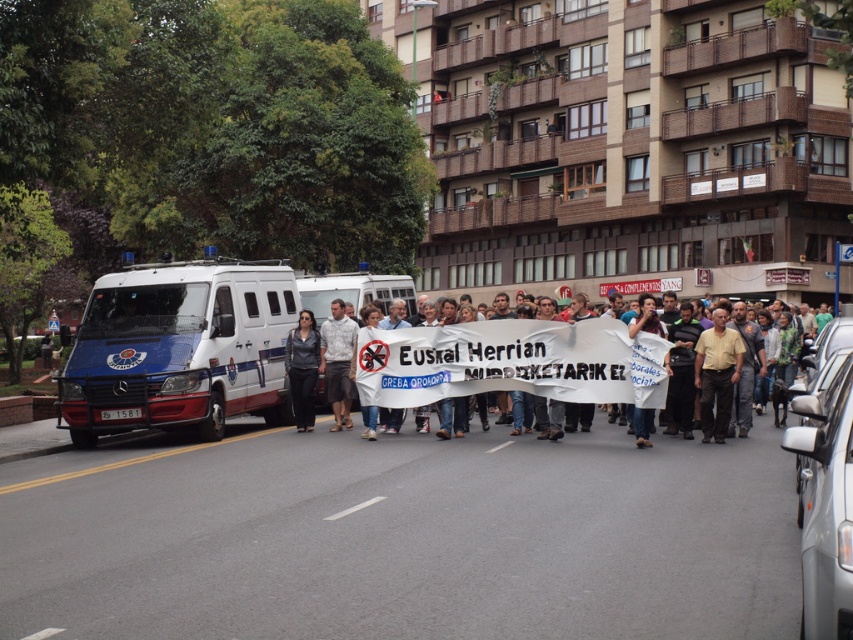
Question: Estimate the real-world distances between objects in this image. Which object is closer to the white paper banner at center?

Choices:
 (A) yellow cotton shirt at center
 (B) dark gray fabric shirt at center
 (C) white glossy van at center-left

Answer: (A)

Question: Is yellow cotton shirt at center bigger than white printed shirt at center?

Choices:
 (A) no
 (B) yes

Answer: (A)

Question: Is white glossy van at center-left above white glossy van at center?

Choices:
 (A) yes
 (B) no

Answer: (B)

Question: Which point is farther to the camera?

Choices:
 (A) 715,387
 (B) 293,392
 (C) 80,436
 (D) 666,344

Answer: (B)

Question: Does yellow cotton shirt at center have a smaller size compared to white printed shirt at center?

Choices:
 (A) yes
 (B) no

Answer: (A)

Question: Which object is farther from the camera taking this photo?

Choices:
 (A) dark gray fabric shirt at center
 (B) white glossy van at center-left
 (C) white glossy van at center
 (D) white paper banner at center

Answer: (C)